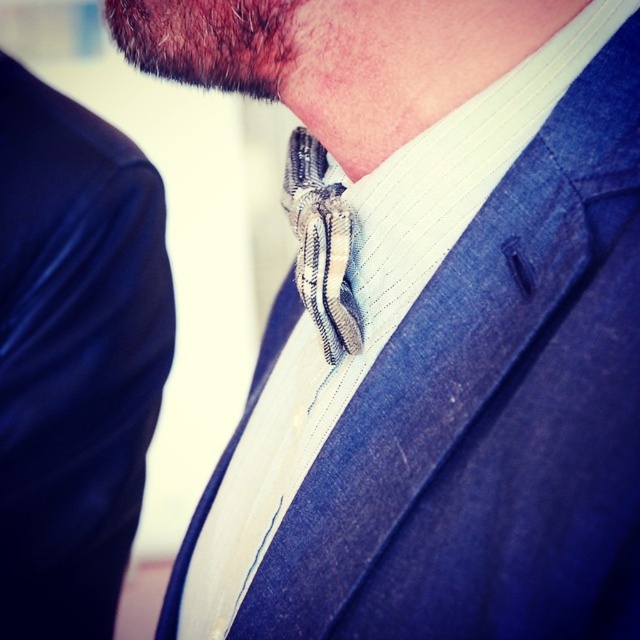
Question: Does white striped dress shirt at center appear under blue denim jacket at left?

Choices:
 (A) no
 (B) yes

Answer: (A)

Question: Which point is farther from the camera taking this photo?

Choices:
 (A) (548, 102)
 (B) (44, 138)

Answer: (B)

Question: Estimate the real-world distances between objects in this image. Which object is farther from the blue denim jacket at left?

Choices:
 (A) striped fabric tie at center
 (B) white striped dress shirt at center

Answer: (B)

Question: Is white striped dress shirt at center thinner than blue denim jacket at left?

Choices:
 (A) no
 (B) yes

Answer: (A)

Question: Which point is farther from the camera taking this photo?

Choices:
 (A) (109, 605)
 (B) (355, 257)
 (C) (330, 234)

Answer: (A)

Question: Is blue denim jacket at left closer to camera compared to striped fabric tie at center?

Choices:
 (A) no
 (B) yes

Answer: (A)